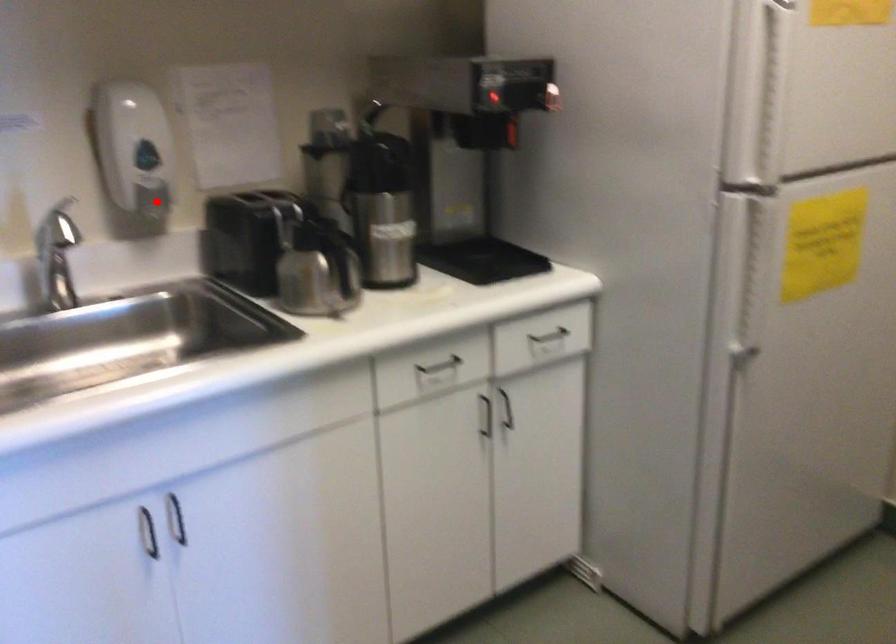
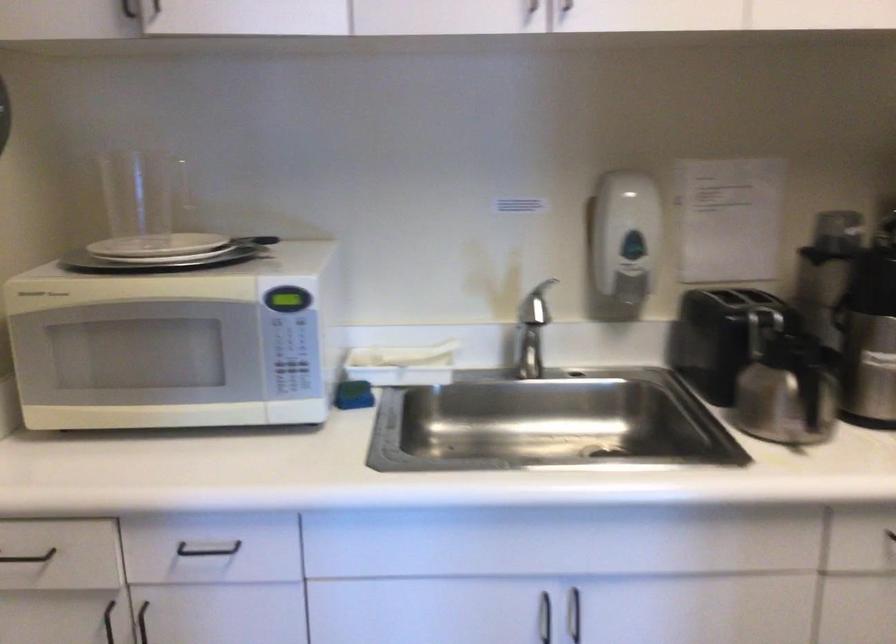
Find the pixel in the second image that matches the highlighted location in the first image.

(631, 288)